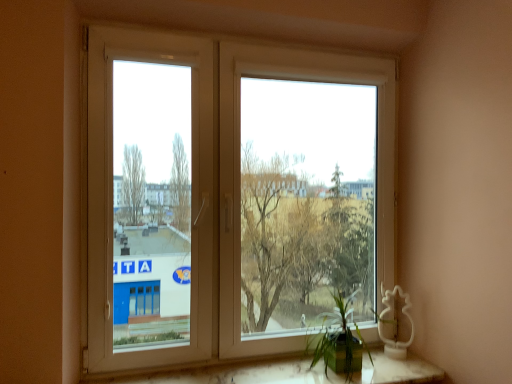
Image resolution: width=512 pixels, height=384 pixels. In order to click on free region under white plastic window at left (from a real-world perspective) in this screenshot , I will do `click(156, 377)`.